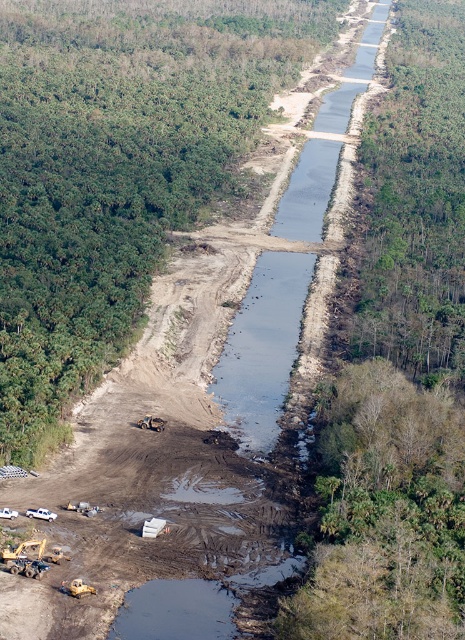
At what (x,y) coordinates should I click in order to perform the action: click on yellow rubber at lower left. Please return your answer as a coordinate pair (x, y). This screenshot has width=465, height=640. Looking at the image, I should click on (77, 588).

Who is more distant from viewer, (74,586) or (165,424)?

The point (165,424) is behind.

Identify the location of yellow rubber at lower left. (77, 588).